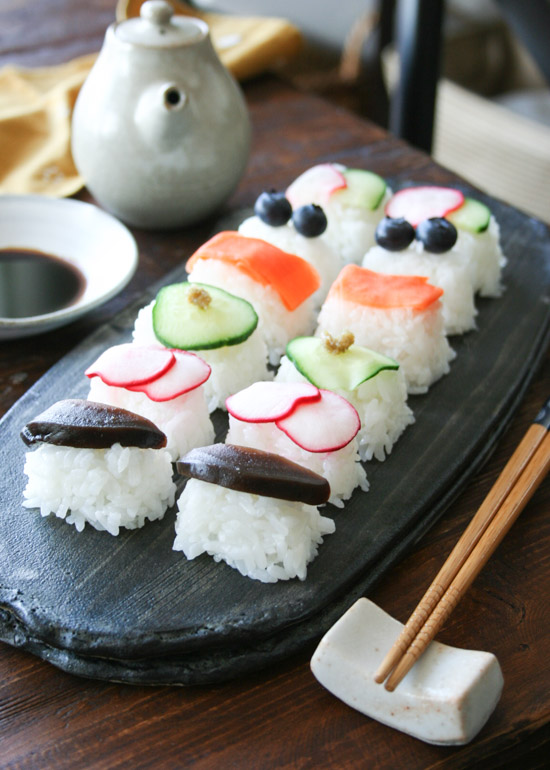
Locate an element on the screen. wooden table is located at coordinates (264, 724).